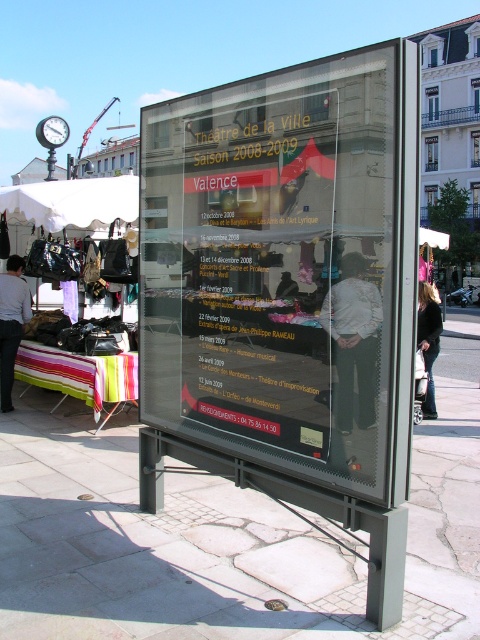
Does white fabric canopy at upper left have a greater height compared to light gray shirt at lower left?

No, white fabric canopy at upper left is not taller than light gray shirt at lower left.

Between point (76, 189) and point (0, 304), which one is positioned in front?

Point (76, 189) is in front.

Identify the location of white fabric canopy at upper left. (72, 202).

Does point (410, 433) lie in front of point (279, 282)?

Yes, it is in front of point (279, 282).

Who is shorter, transparent glass bus stop at center or matte black shirt at center?

matte black shirt at center is shorter.

What do you see at coordinates (288, 298) in the screenshot? The height and width of the screenshot is (640, 480). I see `transparent glass bus stop at center` at bounding box center [288, 298].

Where is `transparent glass bus stop at center`? This screenshot has height=640, width=480. transparent glass bus stop at center is located at coordinates [x=288, y=298].

Between point (333, 195) and point (342, 333), which one is positioned in front?

Point (342, 333)

Between point (156, 280) and point (345, 426), which one is positioned behind?

The point (156, 280) is more distant.

What are the coordinates of `transparent glass bus stop at center` in the screenshot? It's located at (288, 298).